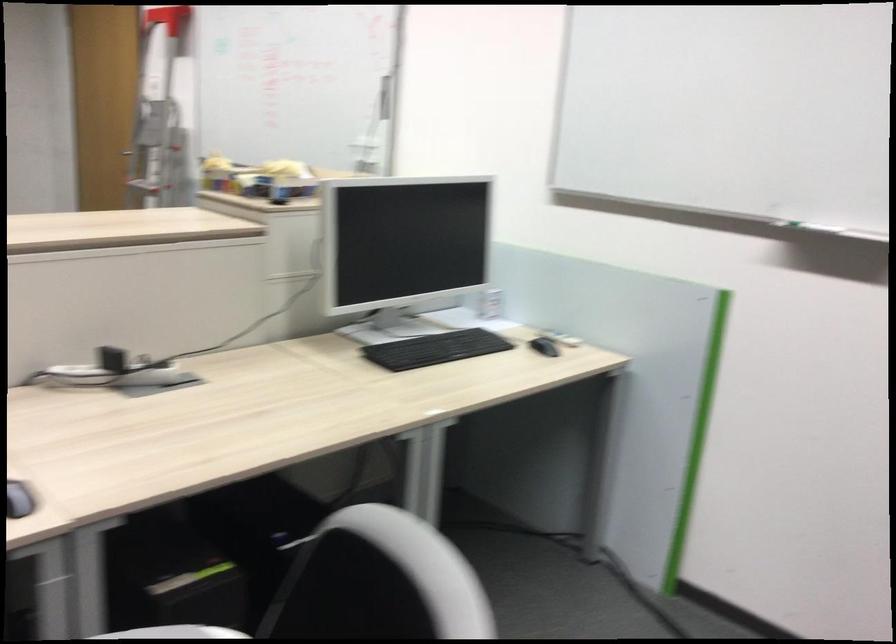
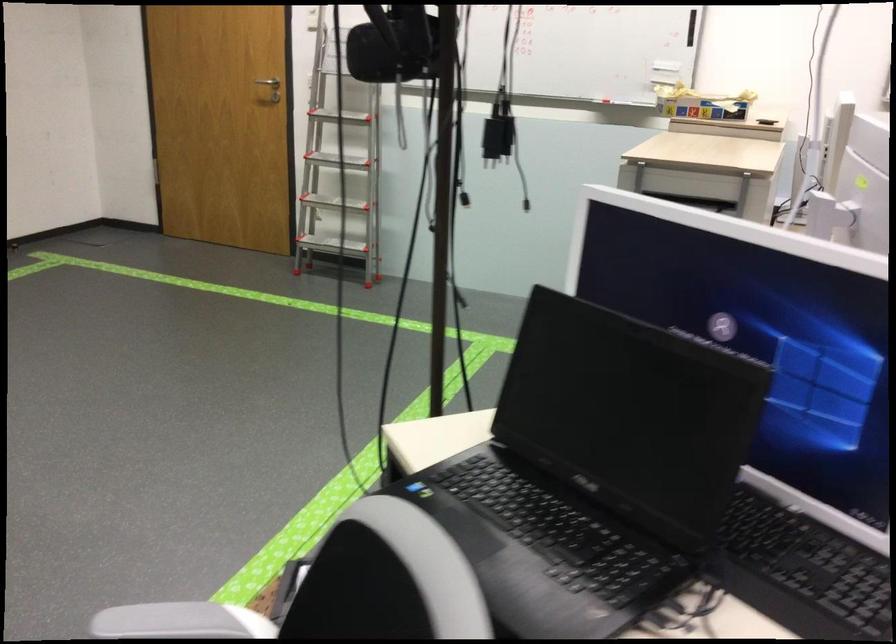
Question: The images are taken continuously from a first-person perspective. In which direction are you moving?

Choices:
 (A) Left
 (B) Right
 (C) Forward
 (D) Backward

Answer: (A)